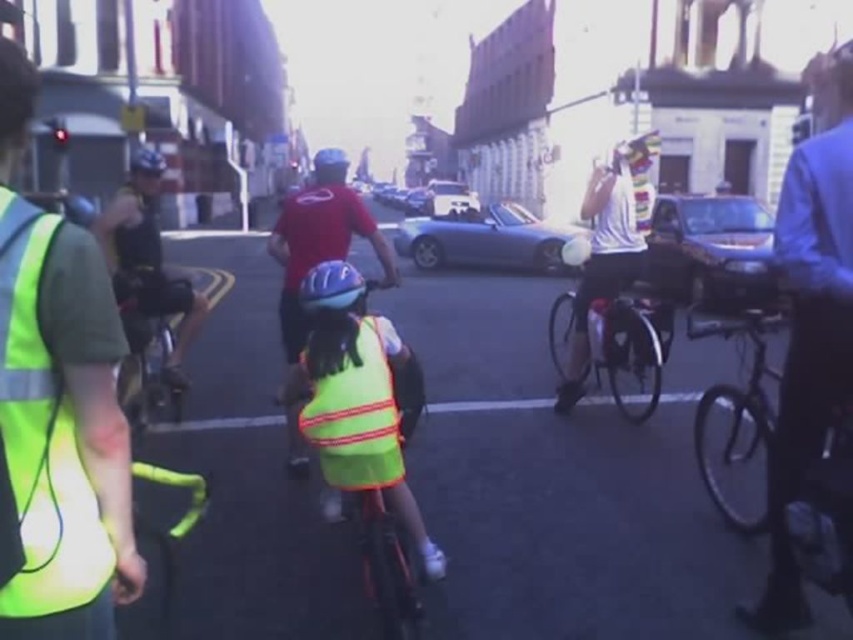
You are a pedestrian standing on the sidewalk and see the matte red shirt at center and the reflective fabric bicycle at center. Which one is located to the left?

The matte red shirt at center is positioned on the left side of the reflective fabric bicycle at center, so the matte red shirt at center is located to the left.

You are a pedestrian standing at the edge of the street where the matte red shirt at center and the reflective fabric bicycle at center are located. Which object would appear closer to you based on their sizes?

The matte red shirt at center is larger in size than the reflective fabric bicycle at center, so it would appear closer to you.

You are standing at the camera position and want to take a photo of the point at coordinates (x=134, y=294). If your camera has a minimum focus distance of 10 feet, will it be able to focus on that point?

The point at coordinates (x=134, y=294) is 11.23 feet from the camera, which is beyond the minimum focus distance of 10 feet. Therefore, the camera should be able to focus on that point.